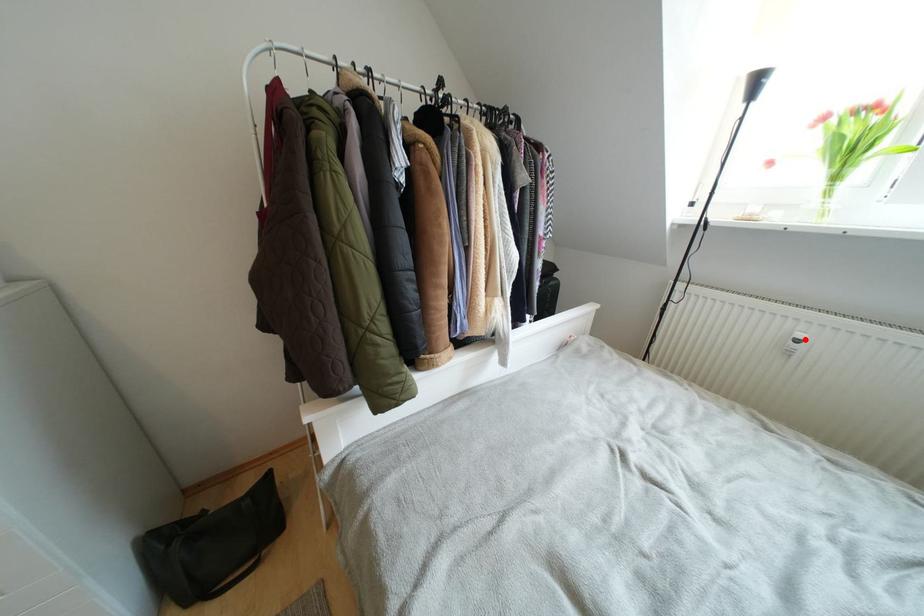
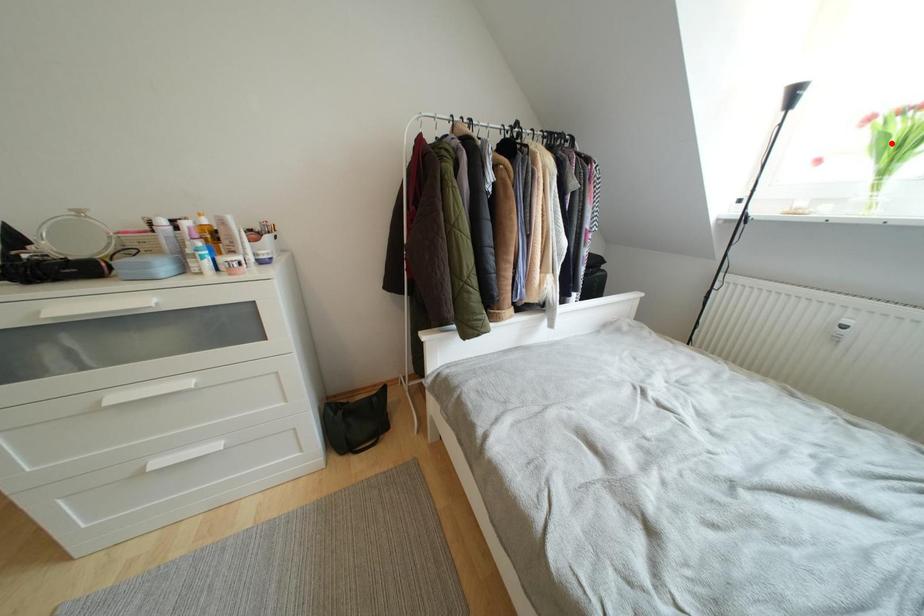
I am providing you with two images of the same scene from different viewpoints. A red point is marked on the first image and another point is marked on the second image. Do the highlighted points in image1 and image2 indicate the same real-world spot?

No